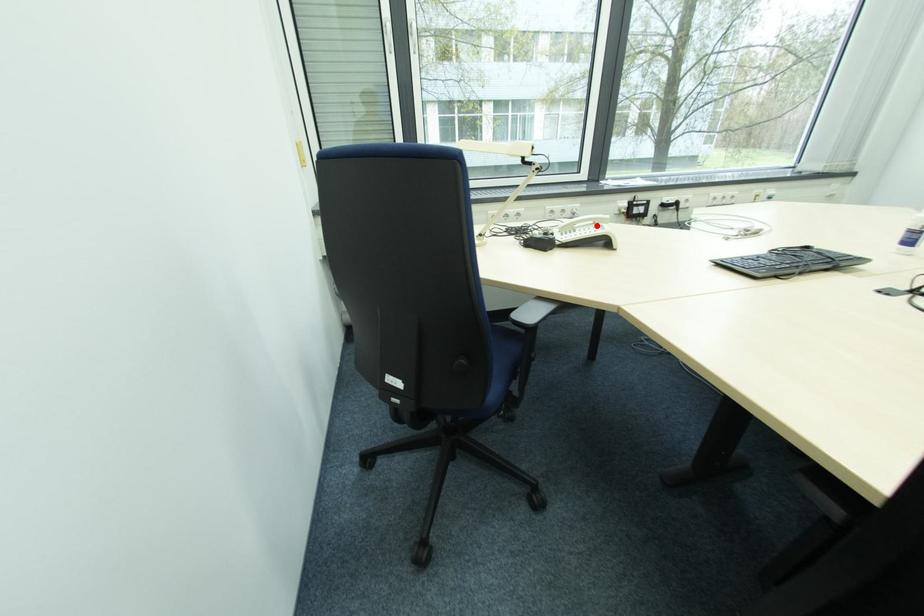
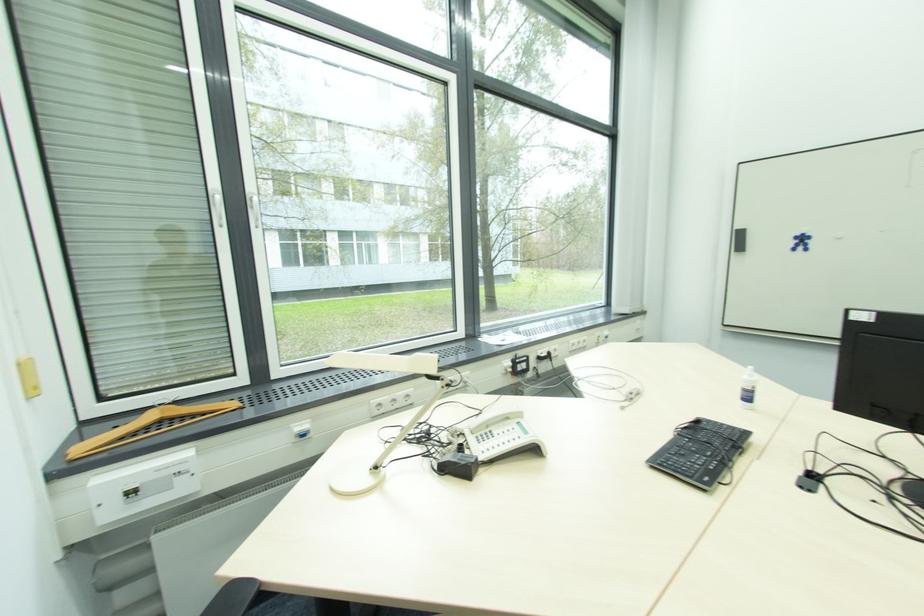
Locate, in the second image, the point that corresponds to the highlighted location in the first image.

(512, 421)